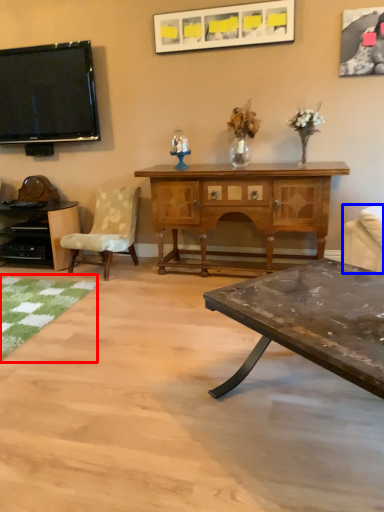
Question: Which point is further to the camera, mat (highlighted by a red box) or studio couch (highlighted by a blue box)?

Choices:
 (A) mat
 (B) studio couch

Answer: (A)